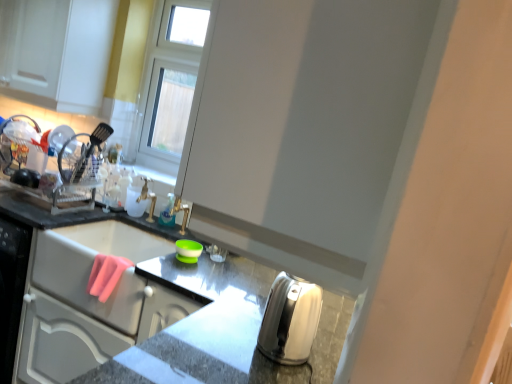
The width and height of the screenshot is (512, 384). I want to click on satin silver toaster at lower right, so click(132, 306).

Locate an element on the screen. The image size is (512, 384). green rubber bowl at center, placed as the second appliance when sorted from right to left is located at coordinates (188, 250).

Measure the distance between point (172, 205) and camera.

The distance of point (172, 205) from camera is 7.35 feet.

Locate an element on the screen. satin silver toaster at lower right is located at coordinates (132, 306).

From the image's perspective, is white glossy cabinet at upper left below translucent plastic bottle at center?

No.

In terms of height, does white glossy cabinet at upper left look taller or shorter compared to translucent plastic bottle at center?

In the image, white glossy cabinet at upper left appears to be taller than translucent plastic bottle at center.

Considering the sizes of objects white glossy cabinet at upper left and translucent plastic bottle at center in the image provided, who is bigger, white glossy cabinet at upper left or translucent plastic bottle at center?

Bigger between the two is white glossy cabinet at upper left.

Is point (96, 17) closer or farther from the camera than point (161, 211)?

Point (96, 17) is farther from the camera than point (161, 211).

From a real-world perspective, who is located lower, satin silver toaster at lower right or translucent plastic bottle at center?

satin silver toaster at lower right is physically lower.

This screenshot has width=512, height=384. In order to click on countertop on the left of translucent plastic bottle at center in this screenshot , I will do `click(132, 306)`.

Does satin silver toaster at lower right turn towards translucent plastic bottle at center?

No, satin silver toaster at lower right is not aimed at translucent plastic bottle at center.

Is satin silver toaster at lower right not inside translucent plastic bottle at center?

Yes, satin silver toaster at lower right is located beyond the bounds of translucent plastic bottle at center.

Is satin silver kettle at lower right, the first appliance when ordered from front to back, next to green rubber bowl at center, which is counted as the first appliance, starting from the back?

No.

Could you measure the distance between satin silver kettle at lower right, the first appliance when ordered from front to back, and green rubber bowl at center, placed as the second appliance when sorted from right to left?

A distance of 26.28 inches exists between satin silver kettle at lower right, the first appliance when ordered from front to back, and green rubber bowl at center, placed as the second appliance when sorted from right to left.

From the image's perspective, is satin silver kettle at lower right, the 2th appliance from the left, below green rubber bowl at center, the 2th appliance viewed from the front?

Yes, from the image's perspective, satin silver kettle at lower right, the 2th appliance from the left, is below green rubber bowl at center, the 2th appliance viewed from the front.

Considering the relative sizes of satin silver kettle at lower right, positioned as the 2th appliance in back-to-front order, and green rubber bowl at center, the 2th appliance viewed from the front, in the image provided, is satin silver kettle at lower right, positioned as the 2th appliance in back-to-front order, smaller than green rubber bowl at center, the 2th appliance viewed from the front,?

No, satin silver kettle at lower right, positioned as the 2th appliance in back-to-front order, is not smaller than green rubber bowl at center, the 2th appliance viewed from the front.

Is white glossy cabinet at upper left in front of or behind green rubber bowl at center, which is counted as the first appliance, starting from the back, in the image?

Visually, white glossy cabinet at upper left is located behind green rubber bowl at center, which is counted as the first appliance, starting from the back.

Is white glossy cabinet at upper left not inside green rubber bowl at center, arranged as the first appliance when viewed from the left?

Absolutely, white glossy cabinet at upper left is external to green rubber bowl at center, arranged as the first appliance when viewed from the left.

Visually, is white glossy cabinet at upper left positioned to the left or to the right of green rubber bowl at center, the 2th appliance viewed from the front?

white glossy cabinet at upper left is positioned on green rubber bowl at center, the 2th appliance viewed from the front,'s left side.

Considering the positions of point (72, 72) and point (194, 259), is point (72, 72) closer or farther from the camera than point (194, 259)?

Point (72, 72) is farther from the camera than point (194, 259).

From the image's perspective, between translucent plastic bottle at center and satin silver toaster at lower right, who is located below?

satin silver toaster at lower right, from the image's perspective.

Considering the sizes of translucent plastic bottle at center and satin silver toaster at lower right in the image, is translucent plastic bottle at center wider or thinner than satin silver toaster at lower right?

Considering their sizes, translucent plastic bottle at center looks slimmer than satin silver toaster at lower right.

From a real-world perspective, which object rests below the other?

satin silver toaster at lower right.

Consider the image. Does translucent plastic bottle at center turn towards satin silver toaster at lower right?

No, translucent plastic bottle at center is not oriented towards satin silver toaster at lower right.

How different are the orientations of satin silver kettle at lower right, placed as the 1th appliance when sorted from right to left, and satin silver toaster at lower right in degrees?

They differ by 91.5 degrees in their facing directions.

From a real-world perspective, who is located lower, satin silver kettle at lower right, the first appliance when ordered from front to back, or satin silver toaster at lower right?

satin silver toaster at lower right.

Does satin silver kettle at lower right, the first appliance when ordered from front to back, have a lesser width compared to satin silver toaster at lower right?

Yes, satin silver kettle at lower right, the first appliance when ordered from front to back, is thinner than satin silver toaster at lower right.

Is satin silver kettle at lower right, the 2th appliance from the left, next to satin silver toaster at lower right?

No, satin silver kettle at lower right, the 2th appliance from the left, is not with satin silver toaster at lower right.

Based on the photo, from a real-world perspective, is satin silver toaster at lower right above or below green rubber bowl at center, arranged as the first appliance when viewed from the left?

From a real-world perspective, satin silver toaster at lower right is physically below green rubber bowl at center, arranged as the first appliance when viewed from the left.

Could you measure the distance between satin silver toaster at lower right and green rubber bowl at center, the 2th appliance viewed from the front?

satin silver toaster at lower right is 16.52 inches from green rubber bowl at center, the 2th appliance viewed from the front.

Considering the positions of point (234, 329) and point (190, 241), is point (234, 329) closer or farther from the camera than point (190, 241)?

Point (234, 329) is closer to the camera than point (190, 241).

Considering the relative sizes of satin silver toaster at lower right and green rubber bowl at center, which is counted as the first appliance, starting from the back, in the image provided, is satin silver toaster at lower right bigger than green rubber bowl at center, which is counted as the first appliance, starting from the back,?

Correct, satin silver toaster at lower right is larger in size than green rubber bowl at center, which is counted as the first appliance, starting from the back.

This screenshot has width=512, height=384. In order to click on cabinetry on the left of the translucent plastic bottle at center in this screenshot , I will do `click(56, 52)`.

In the image, there is a translucent plastic bottle at center. Find the location of `countertop below it (from a real-world perspective)`. countertop below it (from a real-world perspective) is located at coordinates (132, 306).

Considering their positions, is translucent plastic bottle at center positioned closer to green rubber bowl at center, placed as the second appliance when sorted from right to left, than satin silver toaster at lower right?

The object closer to green rubber bowl at center, placed as the second appliance when sorted from right to left, is translucent plastic bottle at center.

When comparing their distances from white glossy cabinet at upper left, does translucent plastic bottle at center or green rubber bowl at center, the 2th appliance viewed from the front, seem further?

Based on the image, green rubber bowl at center, the 2th appliance viewed from the front, appears to be further to white glossy cabinet at upper left.

Consider the image. Considering their positions, is green rubber bowl at center, which is counted as the first appliance, starting from the back, positioned closer to white glossy sink at upper left than translucent plastic bottle at center?

green rubber bowl at center, which is counted as the first appliance, starting from the back, is positioned closer to the anchor white glossy sink at upper left.

From the image, which object appears to be nearer to satin silver toaster at lower right, white glossy sink at upper left or green rubber bowl at center, which is counted as the first appliance, starting from the back?

white glossy sink at upper left is positioned closer to the anchor satin silver toaster at lower right.

Considering their positions, is translucent plastic bottle at center positioned further to white glossy sink at upper left than satin silver kettle at lower right, positioned as the 2th appliance in back-to-front order?

satin silver kettle at lower right, positioned as the 2th appliance in back-to-front order, is further to white glossy sink at upper left.

Looking at the image, which one is located closer to translucent plastic bottle at center, satin silver toaster at lower right or white glossy sink at upper left?

Based on the image, white glossy sink at upper left appears to be nearer to translucent plastic bottle at center.

Estimate the real-world distances between objects in this image. Which object is further from white glossy sink at upper left, satin silver toaster at lower right or translucent plastic bottle at center?

translucent plastic bottle at center is positioned further to the anchor white glossy sink at upper left.

From the image, which object appears to be farther from green rubber bowl at center, placed as the second appliance when sorted from right to left, white glossy cabinet at upper left or satin silver kettle at lower right, positioned as the 2th appliance in back-to-front order?

The object further to green rubber bowl at center, placed as the second appliance when sorted from right to left, is white glossy cabinet at upper left.

This screenshot has height=384, width=512. What are the coordinates of `bottle between white glossy cabinet at upper left and white glossy sink at upper left in the up-down direction` in the screenshot? It's located at (168, 213).

What are the coordinates of `appliance located between satin silver toaster at lower right and translucent plastic bottle at center in the depth direction` in the screenshot? It's located at (188, 250).

This screenshot has height=384, width=512. I want to click on sink between satin silver kettle at lower right, the first appliance when ordered from front to back, and translucent plastic bottle at center from front to back, so click(92, 266).

Locate an element on the screen. The width and height of the screenshot is (512, 384). sink located between satin silver toaster at lower right and satin silver kettle at lower right, the first appliance when ordered from front to back, in the left-right direction is located at coordinates [92, 266].